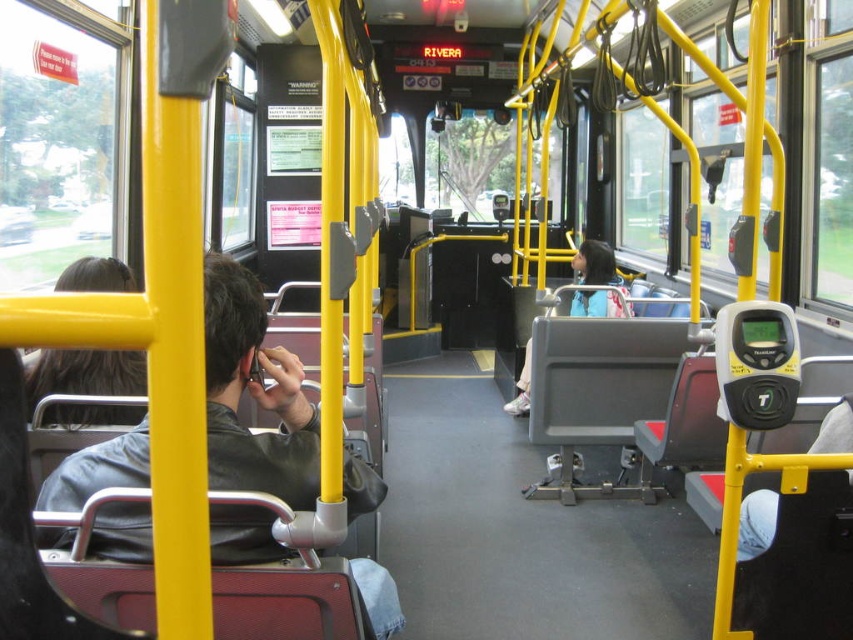
Is leather jacket at left further to the viewer compared to dark brown hair at left?

No, it is not.

Which of these two, leather jacket at left or dark brown hair at left, stands taller?

With more height is leather jacket at left.

Is point (279, 456) positioned in front of point (102, 272)?

Yes, it is.

Find the location of a particular element. leather jacket at left is located at coordinates (253, 394).

Between leather jacket at left and light blue jacket at center, which one appears on the right side from the viewer's perspective?

From the viewer's perspective, light blue jacket at center appears more on the right side.

Is leather jacket at left positioned at the back of light blue jacket at center?

No, leather jacket at left is in front of light blue jacket at center.

Is point (253, 285) positioned before point (614, 300)?

Yes, it is in front of point (614, 300).

You are a GUI agent. You are given a task and a screenshot of the screen. Output one action in this format:
    pyautogui.click(x=<x>, y=<y>)
    Task: Click on the leather jacket at left
    The image size is (853, 640).
    Given the screenshot: What is the action you would take?
    pyautogui.click(x=253, y=394)

Is dark brown hair at left below light blue jacket at center?

Correct, dark brown hair at left is located below light blue jacket at center.

Does point (108, 388) come in front of point (604, 253)?

That is True.

Where is `dark brown hair at left`? dark brown hair at left is located at coordinates (85, 372).